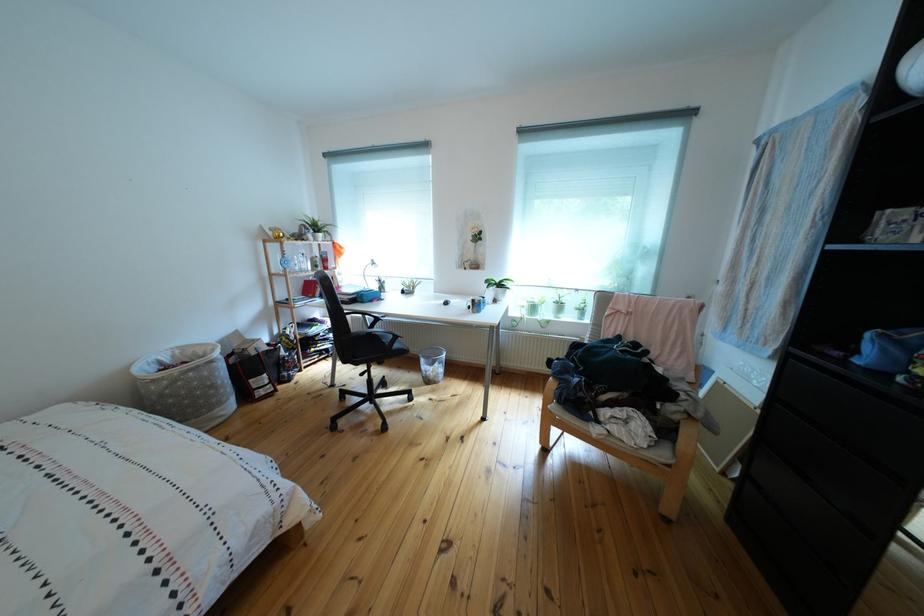
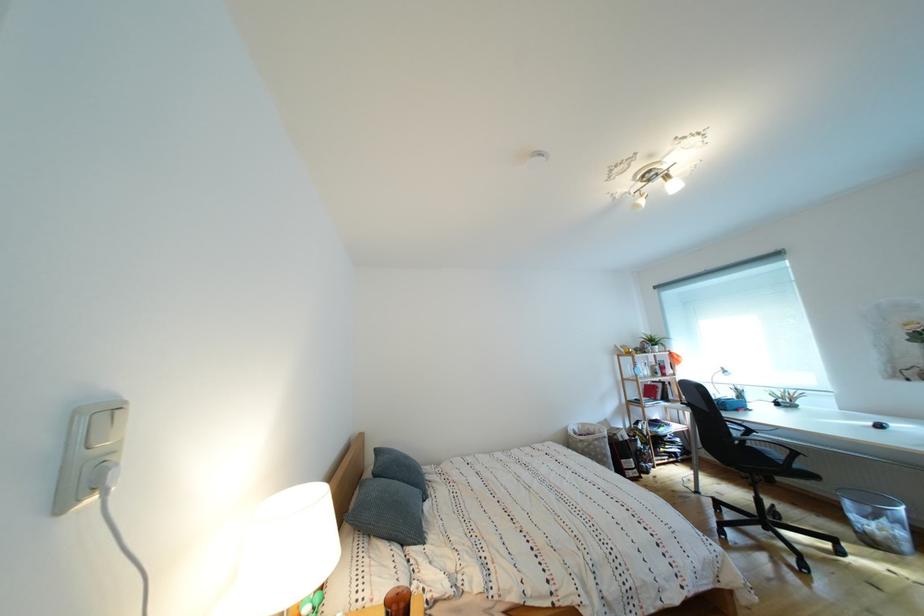
Locate, in the second image, the point that corresponds to point (312, 277) in the first image.

(657, 383)